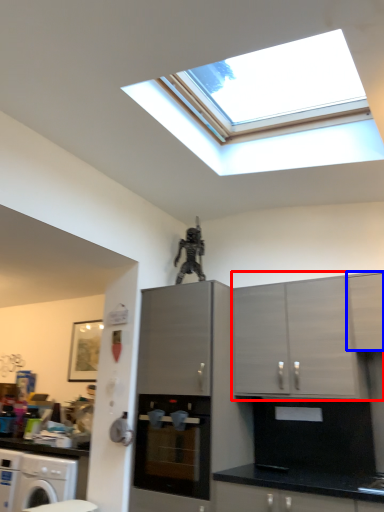
Question: Which object is further to the camera taking this photo, cabinetry (highlighted by a red box) or cabinetry (highlighted by a blue box)?

Choices:
 (A) cabinetry
 (B) cabinetry

Answer: (A)